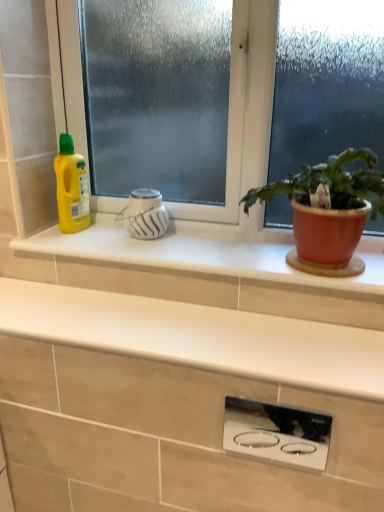
Image resolution: width=384 pixels, height=512 pixels. I want to click on free location in front of white glossy vase at center, which ranks as the 1th appliance in left-to-right order, so click(x=146, y=250).